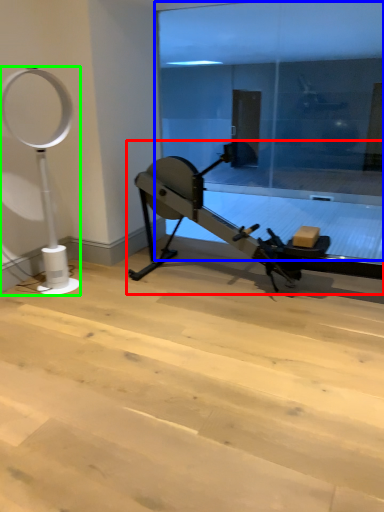
Question: Based on their relative distances, which object is nearer to stationary bicycle (highlighted by a red box)? Choose from glass door (highlighted by a blue box) and basketball hoop (highlighted by a green box).

Choices:
 (A) glass door
 (B) basketball hoop

Answer: (B)